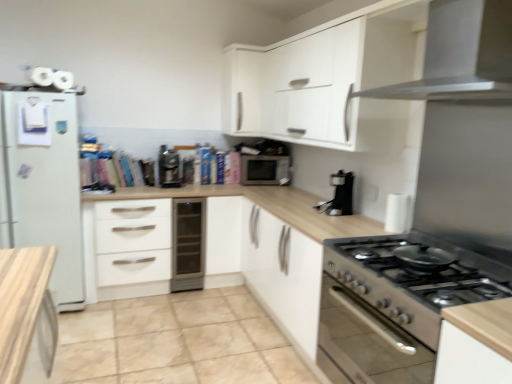
Where is `vacant point to the right of white matte drawer at center`? The height and width of the screenshot is (384, 512). vacant point to the right of white matte drawer at center is located at coordinates (189, 306).